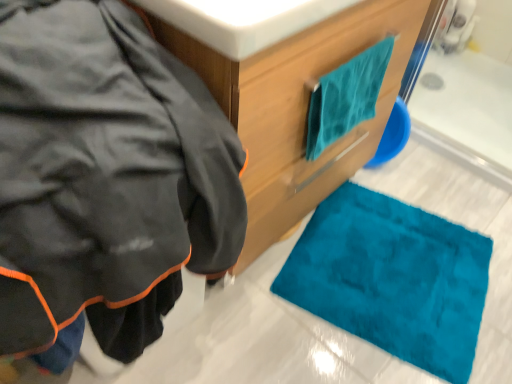
In order to face matte black jacket at left, should I rotate leftwards or rightwards?

Rotate left and turn 22.535 degrees.

Describe the element at coordinates (297, 108) in the screenshot. I see `teal fabric towel at upper right` at that location.

Image resolution: width=512 pixels, height=384 pixels. Find the location of `matte black jacket at left`. matte black jacket at left is located at coordinates (105, 180).

You are a GUI agent. You are given a task and a screenshot of the screen. Output one action in this format:
    pyautogui.click(x=<x>, y=<y>)
    Task: Click on the towel/napkin above the teal fabric towel at upper right (from a real-world perspective)
    The width and height of the screenshot is (512, 384).
    Given the screenshot: What is the action you would take?
    pyautogui.click(x=346, y=97)

Does teal soft towel at upper right have a smaller size compared to teal fabric towel at upper right?

Indeed, teal soft towel at upper right has a smaller size compared to teal fabric towel at upper right.

Considering the sizes of objects teal soft towel at upper right and teal fabric towel at upper right in the image provided, who is wider, teal soft towel at upper right or teal fabric towel at upper right?

teal fabric towel at upper right.

Is teal soft towel at upper right in front of or behind teal fabric towel at upper right in the image?

In the image, teal soft towel at upper right appears behind teal fabric towel at upper right.

Which is less distant, (259, 234) or (230, 25)?

The point (230, 25) is closer.

Is teal fabric towel at upper right inside or outside of white glossy sink at upper center?

The correct answer is: outside.

Based on the photo, considering the relative positions of teal fabric towel at upper right and white glossy sink at upper center in the image provided, is teal fabric towel at upper right to the left of white glossy sink at upper center from the viewer's perspective?

No, teal fabric towel at upper right is not to the left of white glossy sink at upper center.

From the image's perspective, is teal fabric towel at upper right over white glossy sink at upper center?

Incorrect, from the image's perspective, teal fabric towel at upper right is lower than white glossy sink at upper center.

Does teal fabric towel at upper right lie behind teal soft towel at upper right?

No, teal fabric towel at upper right is closer to the camera.

Find the location of `bathroom cabinet that appears on the left of teal soft towel at upper right`. bathroom cabinet that appears on the left of teal soft towel at upper right is located at coordinates (297, 108).

Is teal fabric towel at upper right aimed at teal soft towel at upper right?

Yes, teal fabric towel at upper right is aimed at teal soft towel at upper right.

Who is bigger, teal fabric towel at upper right or teal soft towel at upper right?

teal fabric towel at upper right.

Are white glossy sink at upper center and teal fabric towel at upper right located far from each other?

No, white glossy sink at upper center is not far from teal fabric towel at upper right.

From the picture: Which object is further away from the camera, white glossy sink at upper center or teal fabric towel at upper right?

teal fabric towel at upper right.

Considering the relative sizes of white glossy sink at upper center and teal fabric towel at upper right in the image provided, is white glossy sink at upper center smaller than teal fabric towel at upper right?

Yes, white glossy sink at upper center is smaller than teal fabric towel at upper right.

Is teal fabric towel at upper right located within white glossy sink at upper center?

No, white glossy sink at upper center does not contain teal fabric towel at upper right.

From the picture: Is matte black jacket at left bigger or smaller than white glossy sink at upper center?

In the image, matte black jacket at left appears to be larger than white glossy sink at upper center.

Between matte black jacket at left and white glossy sink at upper center, which one has smaller width?

Thinner between the two is white glossy sink at upper center.

Looking at this image, does matte black jacket at left appear on the right side of white glossy sink at upper center?

Incorrect, matte black jacket at left is not on the right side of white glossy sink at upper center.

Is point (123, 346) farther from camera compared to point (233, 13)?

Yes, it is behind point (233, 13).

Which object is thinner, matte black jacket at left or teal soft towel at upper right?

teal soft towel at upper right.

Between matte black jacket at left and teal soft towel at upper right, which one is positioned behind?

teal soft towel at upper right is further away from the camera.

Can we say matte black jacket at left lies outside teal soft towel at upper right?

Yes, matte black jacket at left is not within teal soft towel at upper right.

Does matte black jacket at left have a greater height compared to teal soft towel at upper right?

Yes.

Which is in front, teal soft towel at upper right or white glossy sink at upper center?

white glossy sink at upper center is closer to the camera.

This screenshot has height=384, width=512. I want to click on sink above the teal soft towel at upper right (from a real-world perspective), so click(242, 20).

Can you confirm if teal soft towel at upper right is wider than white glossy sink at upper center?

In fact, teal soft towel at upper right might be narrower than white glossy sink at upper center.

In order to click on bathroom cabinet that appears on the left of teal soft towel at upper right in this screenshot , I will do `click(297, 108)`.

The width and height of the screenshot is (512, 384). Find the location of `bathroom cabinet lying on the right of white glossy sink at upper center`. bathroom cabinet lying on the right of white glossy sink at upper center is located at coordinates (297, 108).

From the image, which object appears to be farther from teal fabric towel at upper right, teal soft towel at upper right or matte black jacket at left?

matte black jacket at left.

Which object lies nearer to the anchor point white glossy sink at upper center, teal soft towel at upper right or teal fabric towel at upper right?

Based on the image, teal fabric towel at upper right appears to be nearer to white glossy sink at upper center.

In the scene shown: Based on their spatial positions, is matte black jacket at left or white glossy sink at upper center closer to teal fabric towel at upper right?

Among the two, white glossy sink at upper center is located nearer to teal fabric towel at upper right.

When comparing their distances from teal fabric towel at upper right, does white glossy sink at upper center or teal soft towel at upper right seem further?

Among the two, white glossy sink at upper center is located further to teal fabric towel at upper right.

In the scene shown: When comparing their distances from white glossy sink at upper center, does matte black jacket at left or teal fabric towel at upper right seem further?

Based on the image, teal fabric towel at upper right appears to be further to white glossy sink at upper center.

Looking at this image, looking at the image, which one is located closer to teal soft towel at upper right, teal fabric towel at upper right or matte black jacket at left?

Based on the image, teal fabric towel at upper right appears to be nearer to teal soft towel at upper right.

Based on their spatial positions, is teal soft towel at upper right or matte black jacket at left closer to white glossy sink at upper center?

The object closer to white glossy sink at upper center is matte black jacket at left.

When comparing their distances from matte black jacket at left, does white glossy sink at upper center or teal fabric towel at upper right seem closer?

white glossy sink at upper center is closer to matte black jacket at left.

Image resolution: width=512 pixels, height=384 pixels. I want to click on sink between matte black jacket at left and teal soft towel at upper right along the z-axis, so click(x=242, y=20).

Locate an element on the screen. The height and width of the screenshot is (384, 512). bathroom cabinet between matte black jacket at left and teal soft towel at upper right in the front-back direction is located at coordinates (297, 108).

The height and width of the screenshot is (384, 512). I want to click on sink between matte black jacket at left and teal fabric towel at upper right from left to right, so click(x=242, y=20).

Locate an element on the screen. The width and height of the screenshot is (512, 384). bathroom cabinet positioned between white glossy sink at upper center and teal soft towel at upper right from near to far is located at coordinates coord(297,108).